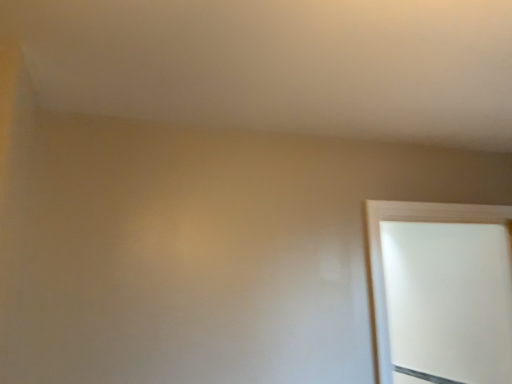
Question: Should I look upward or downward to see white glossy door at right?

Choices:
 (A) down
 (B) up

Answer: (A)